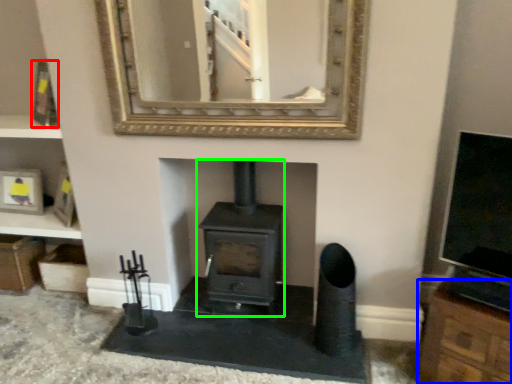
Question: Considering the real-world distances, which object is closest to picture frame (highlighted by a red box)? cabinetry (highlighted by a blue box) or wood burning stove (highlighted by a green box).

Choices:
 (A) cabinetry
 (B) wood burning stove

Answer: (B)